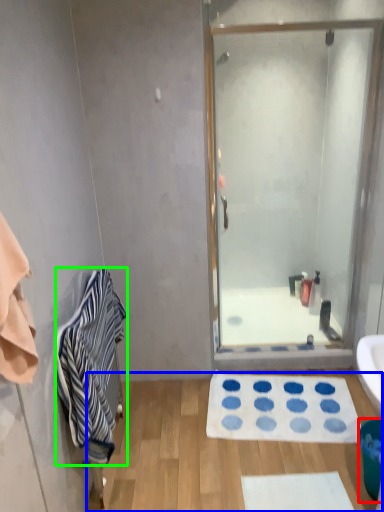
Question: Which object is the farthest from trash bin/can (highlighted by a red box)? Choose among these: plain (highlighted by a blue box) or towel/napkin (highlighted by a green box).

Choices:
 (A) plain
 (B) towel/napkin

Answer: (B)